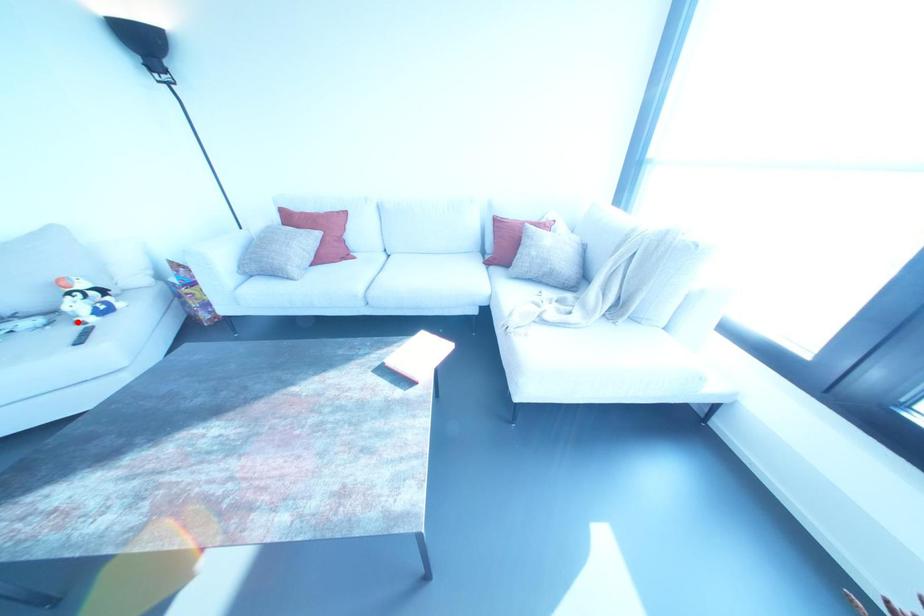
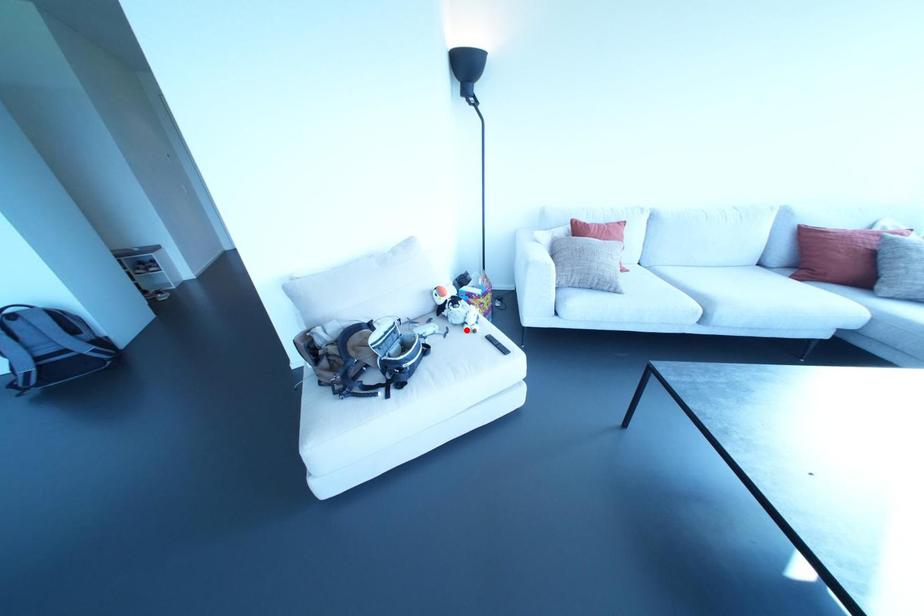
I am providing you with two images of the same scene from different viewpoints. A red point is marked on the first image and another point is marked on the second image. Do the highlighted points in image1 and image2 indicate the same real-world spot?

Yes